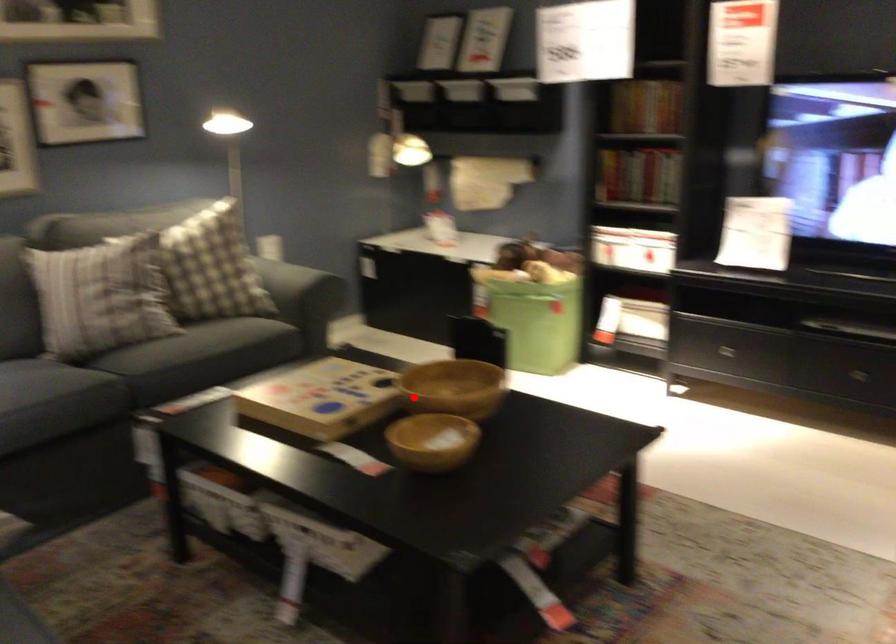
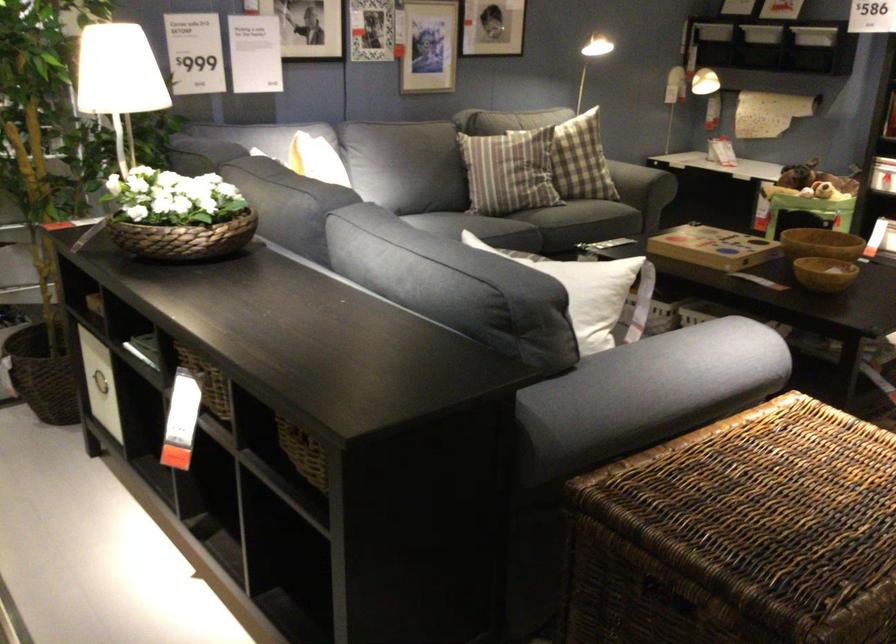
The point at the highlighted location is marked in the first image. Where is the corresponding point in the second image?

(821, 243)